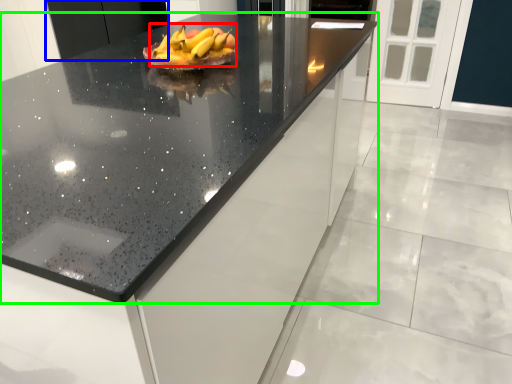
Question: Which object is the farthest from grapefruit (highlighted by a red box)? Choose among these: cabinetry (highlighted by a blue box) or countertop (highlighted by a green box).

Choices:
 (A) cabinetry
 (B) countertop

Answer: (A)